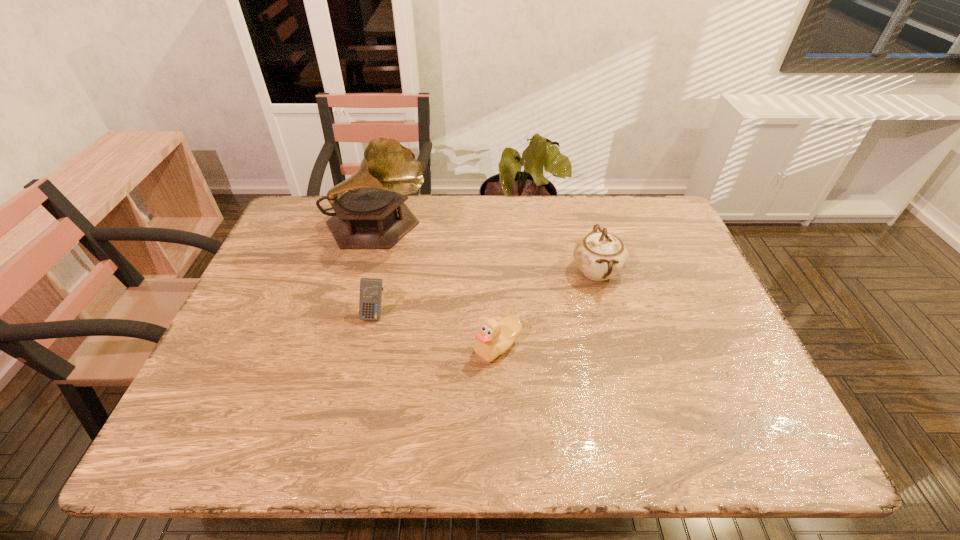
Image resolution: width=960 pixels, height=540 pixels. Find the location of `the tallest object`. the tallest object is located at coordinates (370, 213).

Image resolution: width=960 pixels, height=540 pixels. Identify the location of chinaware. (600, 255).

Identify the location of the rightmost object. tap(600, 255).

This screenshot has height=540, width=960. In order to click on calculator in this screenshot , I will do `click(371, 289)`.

Where is `the nearest object`? The width and height of the screenshot is (960, 540). the nearest object is located at coordinates (494, 338).

Image resolution: width=960 pixels, height=540 pixels. I want to click on duck, so click(x=494, y=338).

Identify the location of vacant area located on the horn direction of the phonograph record. (513, 227).

Where is `free space located on the front of the chinaware`? free space located on the front of the chinaware is located at coordinates (615, 340).

Find the location of a particular element. This screenshot has height=540, width=960. free region located 0.090m on the front-facing side of the third farthest object is located at coordinates (365, 354).

Identify the location of free location located 0.300m at the beak of the second object from right to left. (344, 347).